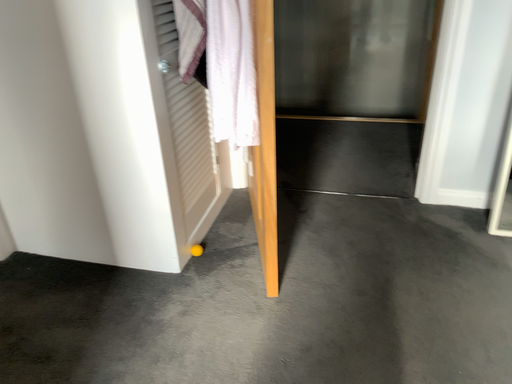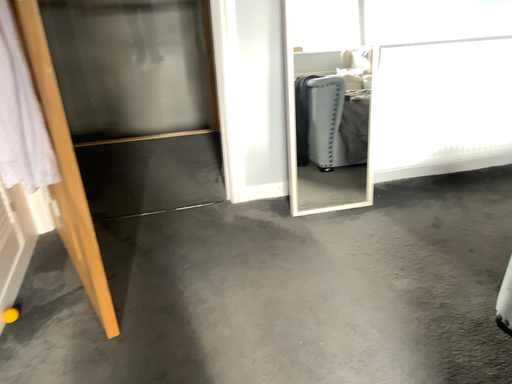
Question: How did the camera likely rotate when shooting the video?

Choices:
 (A) rotated left
 (B) rotated right

Answer: (B)